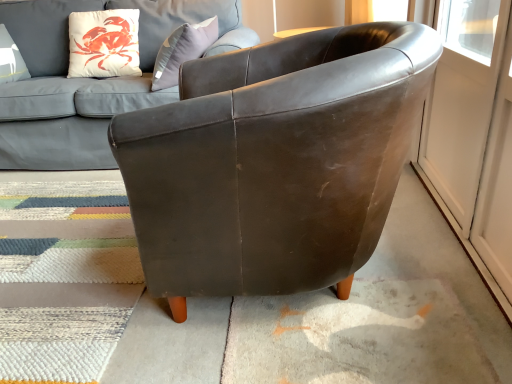
This screenshot has width=512, height=384. What do you see at coordinates (89, 79) in the screenshot?
I see `matte leather couch at upper center` at bounding box center [89, 79].

At what (x,y) coordinates should I click in order to perform the action: click on matte leather couch at upper center. Please return your answer as a coordinate pair (x, y). This screenshot has width=512, height=384. Looking at the image, I should click on (89, 79).

What do you see at coordinates (64, 274) in the screenshot?
I see `textured wool mat at lower left` at bounding box center [64, 274].

Where is `white glossy screen door at right`? This screenshot has height=384, width=512. white glossy screen door at right is located at coordinates (462, 101).

You are a GUI agent. You are given a task and a screenshot of the screen. Output one action in this format:
    pyautogui.click(x=<x>, y=<y>)
    Task: Click on the leather chair at center
    
    Given the screenshot: What is the action you would take?
    pyautogui.click(x=274, y=162)

Does matte leather couch at upper center have a smaller size compared to leather chair at center?

Incorrect, matte leather couch at upper center is not smaller in size than leather chair at center.

Based on the photo, how distant is matte leather couch at upper center from leather chair at center?

38.57 inches.

Does matte leather couch at upper center appear on the right side of leather chair at center?

No, matte leather couch at upper center is not to the right of leather chair at center.

Does matte leather couch at upper center touch leather chair at center?

No, matte leather couch at upper center is not making contact with leather chair at center.

Who is shorter, white glossy screen door at right or leather chair at center?

white glossy screen door at right is shorter.

Can you see white glossy screen door at right touching leather chair at center?

white glossy screen door at right and leather chair at center are not in contact.

Which of these two, white glossy screen door at right or leather chair at center, is thinner?

white glossy screen door at right.

Considering the sizes of objects white glossy screen door at right and matte leather couch at upper center in the image provided, who is shorter, white glossy screen door at right or matte leather couch at upper center?

white glossy screen door at right is shorter.

Locate an element on the screen. The width and height of the screenshot is (512, 384). studio couch that is above the white glossy screen door at right (from a real-world perspective) is located at coordinates (89, 79).

From the image's perspective, between white glossy screen door at right and matte leather couch at upper center, which one is located above?

matte leather couch at upper center appears higher in the image.

Can you confirm if white glossy screen door at right is bigger than matte leather couch at upper center?

Actually, white glossy screen door at right might be smaller than matte leather couch at upper center.

Would you consider leather chair at center to be distant from white glossy screen door at right?

leather chair at center is actually quite close to white glossy screen door at right.

Is point (307, 41) in front of point (487, 97)?

No.

In the scene shown: Can you confirm if leather chair at center is shorter than white glossy screen door at right?

No, leather chair at center is not shorter than white glossy screen door at right.

Can you confirm if leather chair at center is smaller than white glossy screen door at right?

No, leather chair at center is not smaller than white glossy screen door at right.

The height and width of the screenshot is (384, 512). In order to click on studio couch behind the white glossy screen door at right in this screenshot , I will do `click(89, 79)`.

Can you confirm if matte leather couch at upper center is bigger than white glossy screen door at right?

Indeed, matte leather couch at upper center has a larger size compared to white glossy screen door at right.

Is matte leather couch at upper center closer to camera compared to white glossy screen door at right?

No, matte leather couch at upper center is further to the viewer.

Is point (22, 36) in front of point (440, 85)?

No, (22, 36) is further to viewer.

Does textured wool mat at lower left have a lesser width compared to matte leather couch at upper center?

In fact, textured wool mat at lower left might be wider than matte leather couch at upper center.

Is textured wool mat at lower left facing towards matte leather couch at upper center?

Yes.

Considering the points (71, 253) and (155, 29), which point is behind, point (71, 253) or point (155, 29)?

The point (155, 29) is more distant.

Is textured wool mat at lower left in front of or behind matte leather couch at upper center in the image?

In the image, textured wool mat at lower left appears in front of matte leather couch at upper center.

Is textured wool mat at lower left further to camera compared to leather chair at center?

That is True.

Does textured wool mat at lower left turn towards leather chair at center?

No, textured wool mat at lower left is not facing towards leather chair at center.

Considering the positions of points (92, 171) and (312, 143), is point (92, 171) closer to camera compared to point (312, 143)?

No.

Find the location of `chair located in front of the matte leather couch at upper center`. chair located in front of the matte leather couch at upper center is located at coordinates (274, 162).

At what (x,y) coordinates should I click in order to perform the action: click on chair that appears on the left of white glossy screen door at right. Please return your answer as a coordinate pair (x, y). Image resolution: width=512 pixels, height=384 pixels. Looking at the image, I should click on (274, 162).

Based on their spatial positions, is matte leather couch at upper center or leather chair at center further from white glossy screen door at right?

Based on the image, matte leather couch at upper center appears to be further to white glossy screen door at right.

Which object lies nearer to the anchor point textured wool mat at lower left, leather chair at center or white glossy screen door at right?

leather chair at center lies closer to textured wool mat at lower left than the other object.

In the scene shown: Estimate the real-world distances between objects in this image. Which object is further from textured wool mat at lower left, white glossy screen door at right or leather chair at center?

white glossy screen door at right lies further to textured wool mat at lower left than the other object.

Which object lies further to the anchor point white glossy screen door at right, textured wool mat at lower left or matte leather couch at upper center?

matte leather couch at upper center is positioned further to the anchor white glossy screen door at right.

Based on their spatial positions, is textured wool mat at lower left or matte leather couch at upper center closer to leather chair at center?

The object closer to leather chair at center is textured wool mat at lower left.

Considering their positions, is matte leather couch at upper center positioned further to textured wool mat at lower left than leather chair at center?

Among the two, leather chair at center is located further to textured wool mat at lower left.

Considering their positions, is textured wool mat at lower left positioned further to leather chair at center than white glossy screen door at right?

textured wool mat at lower left is further to leather chair at center.

Which object lies nearer to the anchor point leather chair at center, white glossy screen door at right or textured wool mat at lower left?

white glossy screen door at right.

Locate an element on the screen. The width and height of the screenshot is (512, 384). mat between matte leather couch at upper center and white glossy screen door at right is located at coordinates (64, 274).

You are a GUI agent. You are given a task and a screenshot of the screen. Output one action in this format:
    pyautogui.click(x=<x>, y=<y>)
    Task: Click on the chair between textured wool mat at lower left and white glossy screen door at right
    The height and width of the screenshot is (384, 512).
    Given the screenshot: What is the action you would take?
    pyautogui.click(x=274, y=162)

Find the location of a particular element. chair located between matte leather couch at upper center and white glossy screen door at right in the left-right direction is located at coordinates (274, 162).

The image size is (512, 384). In order to click on mat between leather chair at center and matte leather couch at upper center in the front-back direction in this screenshot , I will do `click(64, 274)`.